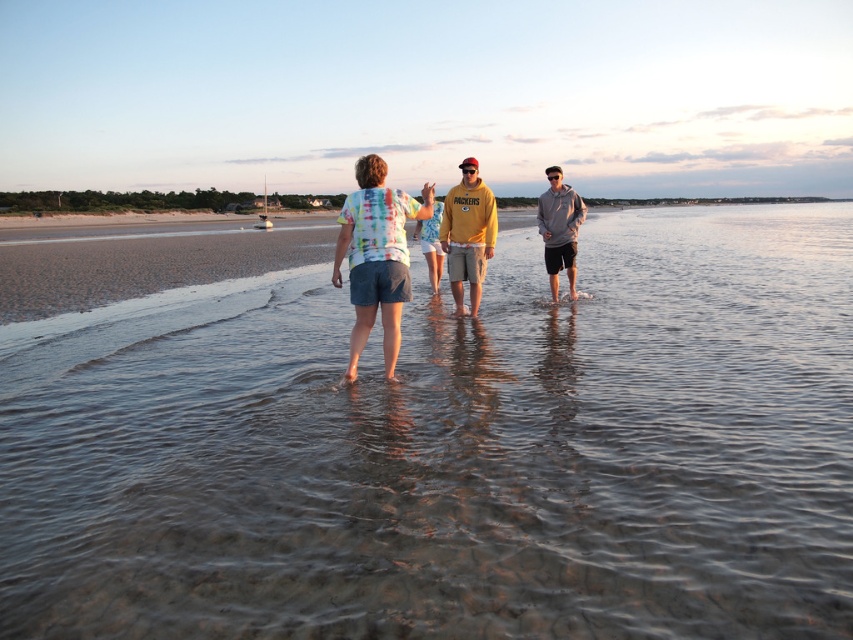
You are standing on the beach and see the clear water at center and the gray hoodie at center. Which one is higher up in the image?

The clear water at center is much taller than the gray hoodie at center, so the clear water at center is higher up in the image.

You are a photographer trying to capture a group photo of the yellow fleece at center and the gray hoodie at center. Since you want both subjects to be clearly visible, which one should you focus on first to ensure the background is not blurry?

The yellow fleece at center occupies less space than gray hoodie at center, so you should focus on the gray hoodie at center first to ensure the background is not blurry.